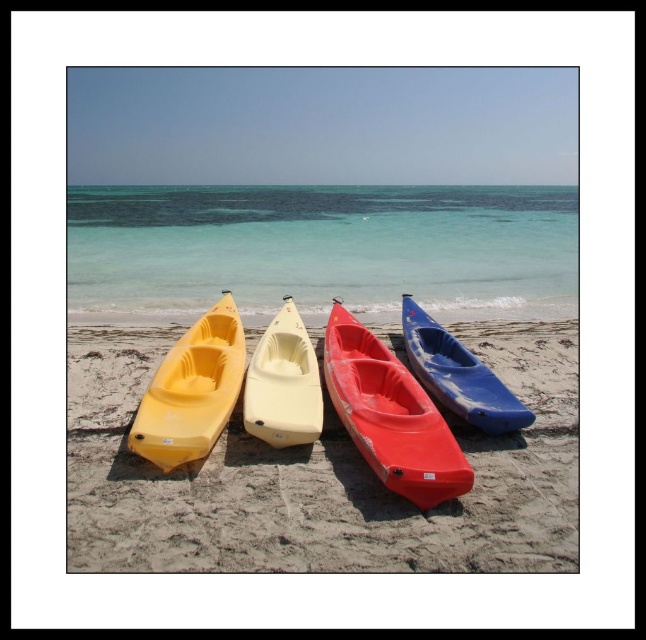
Question: Does smooth sand at center appear on the right side of clear blue water at center?

Choices:
 (A) yes
 (B) no

Answer: (B)

Question: Observing the image, what is the correct spatial positioning of smooth sand at center in reference to matte yellow canoe at left?

Choices:
 (A) right
 (B) left

Answer: (A)

Question: Which of the following is the closest to the observer?

Choices:
 (A) matte yellow canoe at left
 (B) clear blue water at center
 (C) blue glossy canoe at center
 (D) matte red canoe at center

Answer: (D)

Question: Observing the image, what is the correct spatial positioning of matte red canoe at center in reference to matte yellow canoe at center?

Choices:
 (A) right
 (B) left

Answer: (A)

Question: Which is farther from the blue glossy canoe at center?

Choices:
 (A) matte red canoe at center
 (B) matte yellow canoe at left
 (C) clear blue water at center
 (D) smooth sand at center

Answer: (C)

Question: Which point is farther to the camera?

Choices:
 (A) blue glossy canoe at center
 (B) clear blue water at center
 (C) matte yellow canoe at center
 (D) matte yellow canoe at left

Answer: (B)